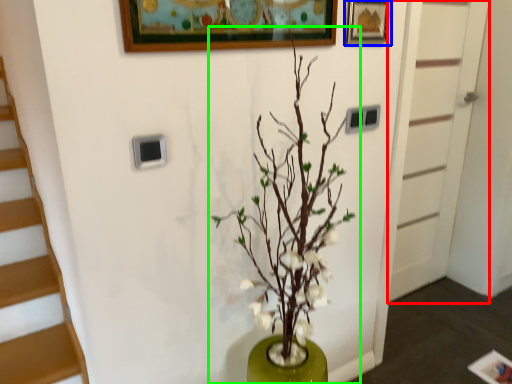
Question: Which is nearer to the door (highlighted by a red box)? picture frame (highlighted by a blue box) or houseplant (highlighted by a green box).

Choices:
 (A) picture frame
 (B) houseplant

Answer: (A)